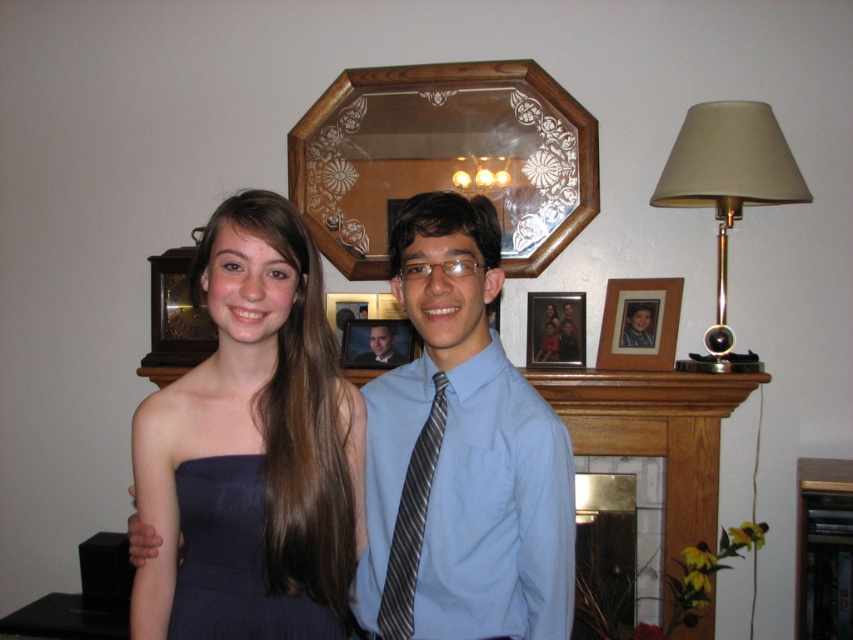
Question: Does navy satin dress at center appear on the left side of wooden picture frame at upper center?

Choices:
 (A) no
 (B) yes

Answer: (B)

Question: Is matte blue dress at center smaller than wooden framed photo at center?

Choices:
 (A) no
 (B) yes

Answer: (A)

Question: Does matte blue dress at center appear on the right side of smooth gray suit at center?

Choices:
 (A) no
 (B) yes

Answer: (A)

Question: Among these points, which one is nearest to the camera?

Choices:
 (A) (216, 577)
 (B) (380, 355)
 (C) (338, 472)

Answer: (A)

Question: Which point is farther to the camera?

Choices:
 (A) (535, 400)
 (B) (317, 621)
 (C) (228, 586)

Answer: (B)

Question: Which of the following is the closest to the observer?

Choices:
 (A) marble fireplace at lower center
 (B) striped fabric tie at center
 (C) matte blue dress at center
 (D) blue satin shirt at center

Answer: (C)